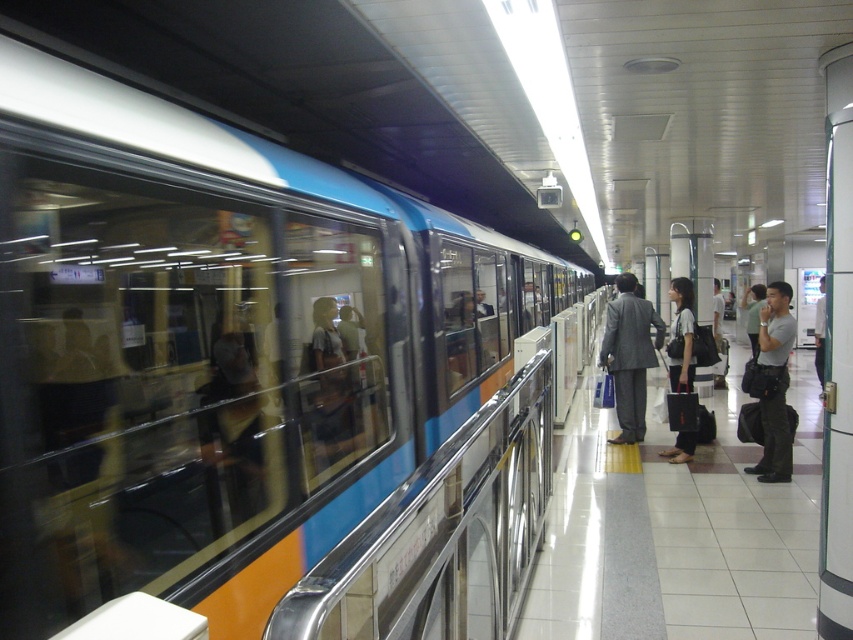
You are a commuter who just arrived at the subway station and see the gray fabric bag at right and the matte black bag at center. Which bag should you avoid stepping on to prevent tripping over something larger?

You should avoid stepping on the gray fabric bag at right because it is bigger than the matte black bag at center, making it more likely to cause a tripping hazard.

You are a commuter standing on the subway platform and notice two bags. The gray fabric bag at right and the matte black bag at center. Which bag is taller?

The gray fabric bag at right is taller than the matte black bag at center.